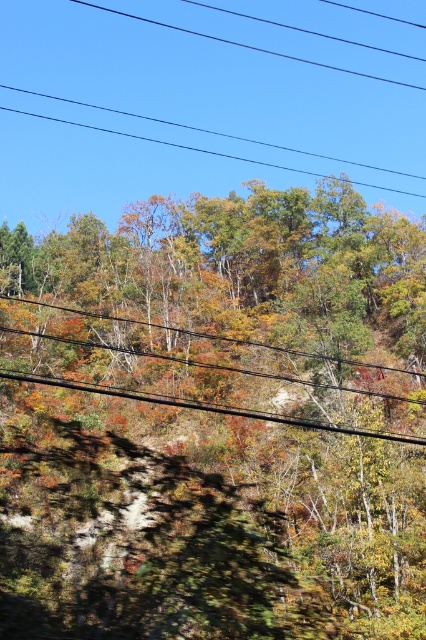
In the scene shown: You are standing in the autumnal forest and want to walk from the point at coordinates point (9, 109) to the point at coordinates point (71, 387). Which direction should you face to move towards the second point?

Since point (9, 109) is closer to you than point (71, 387), you should face away from yourself towards point (71, 387) to move towards it.

You are a bird flying over the autumnal forest scene. You see autumn leaves at upper center and black wire at upper center. Which object is closer to the ground?

The autumn leaves at upper center are positioned under the black wire at upper center, so the autumn leaves at upper center are closer to the ground.

You are a photographer wanting to capture the autumn leaves at upper center and the black wire at center in your shot. Based on their heights, which object should you focus on first if you want to ensure both are in focus?

The autumn leaves at upper center is much taller than the black wire at center, so you should focus on the autumn leaves at upper center first to ensure both are in focus.